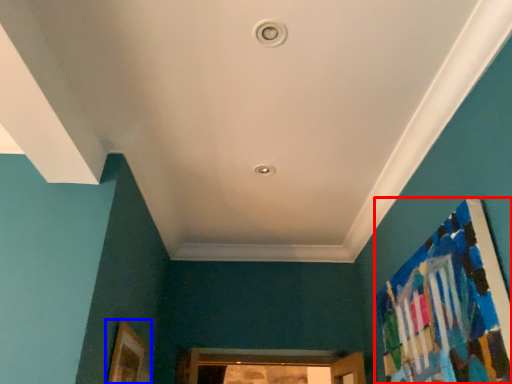
Question: Which object is further to the camera taking this photo, bulletin board (highlighted by a red box) or picture frame (highlighted by a blue box)?

Choices:
 (A) bulletin board
 (B) picture frame

Answer: (B)